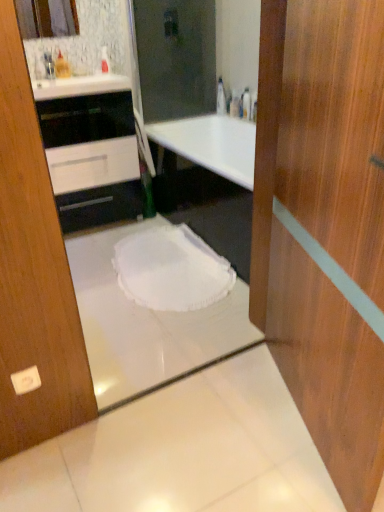
Question: Is transparent plastic bottle at upper center not within black glossy cabinet at upper left?

Choices:
 (A) yes
 (B) no

Answer: (A)

Question: Could you tell me if transparent plastic bottle at upper center is turned towards black glossy cabinet at upper left?

Choices:
 (A) yes
 (B) no

Answer: (B)

Question: From a real-world perspective, is transparent plastic bottle at upper center located beneath black glossy cabinet at upper left?

Choices:
 (A) no
 (B) yes

Answer: (A)

Question: Is transparent plastic bottle at upper center far away from black glossy cabinet at upper left?

Choices:
 (A) yes
 (B) no

Answer: (A)

Question: Considering the relative positions of transparent plastic bottle at upper center and black glossy cabinet at upper left in the image provided, is transparent plastic bottle at upper center to the left of black glossy cabinet at upper left from the viewer's perspective?

Choices:
 (A) yes
 (B) no

Answer: (B)

Question: Is transparent plastic bottle at upper center wider or thinner than matte glass mirror at upper left?

Choices:
 (A) wide
 (B) thin

Answer: (A)

Question: Choose the correct answer: Is transparent plastic bottle at upper center inside matte glass mirror at upper left or outside it?

Choices:
 (A) inside
 (B) outside

Answer: (B)

Question: Is point (218, 101) positioned closer to the camera than point (51, 28)?

Choices:
 (A) closer
 (B) farther

Answer: (B)

Question: Considering the positions of transparent plastic bottle at upper center and matte glass mirror at upper left in the image, is transparent plastic bottle at upper center bigger or smaller than matte glass mirror at upper left?

Choices:
 (A) big
 (B) small

Answer: (B)

Question: From a real-world perspective, is white fabric toilet at center physically located above or below black glossy cabinet at upper left?

Choices:
 (A) above
 (B) below

Answer: (B)

Question: Considering the positions of white fabric toilet at center and black glossy cabinet at upper left in the image, is white fabric toilet at center bigger or smaller than black glossy cabinet at upper left?

Choices:
 (A) big
 (B) small

Answer: (B)

Question: Is point (203, 247) closer or farther from the camera than point (59, 108)?

Choices:
 (A) closer
 (B) farther

Answer: (B)

Question: Is white fabric toilet at center wider or thinner than black glossy cabinet at upper left?

Choices:
 (A) wide
 (B) thin

Answer: (A)

Question: Is white fabric bath at center bigger or smaller than transparent plastic bottle at upper center?

Choices:
 (A) small
 (B) big

Answer: (B)

Question: Is point (203, 351) closer or farther from the camera than point (220, 98)?

Choices:
 (A) farther
 (B) closer

Answer: (B)